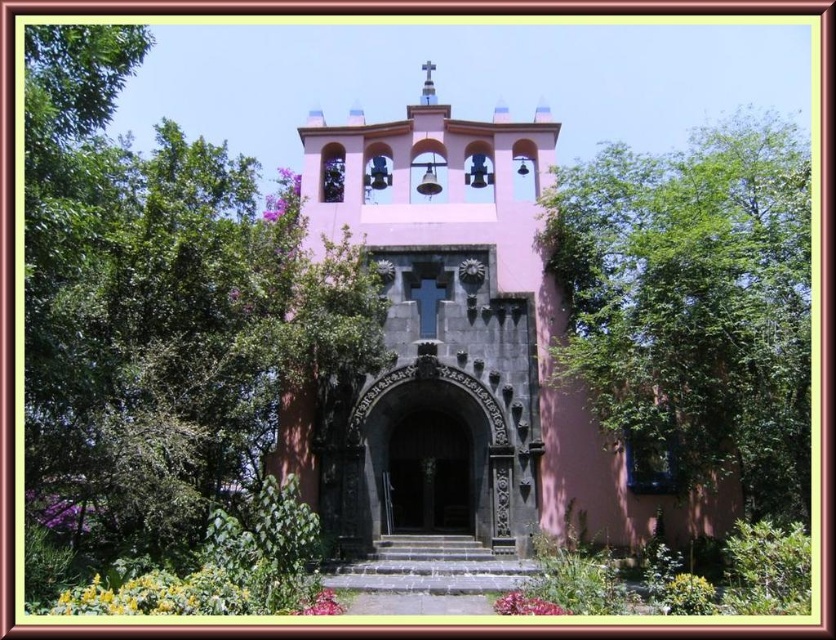
Is point (752, 161) behind point (426, 476)?

Yes, point (752, 161) is behind point (426, 476).

What do you see at coordinates (692, 307) in the screenshot? I see `green leafy tree at upper right` at bounding box center [692, 307].

Locate an element on the screen. Image resolution: width=836 pixels, height=640 pixels. green leafy tree at upper right is located at coordinates click(x=692, y=307).

Does green leafy tree at center appear on the left side of pink matte church at center?

Indeed, green leafy tree at center is positioned on the left side of pink matte church at center.

Is green leafy tree at center wider than pink matte church at center?

Indeed, green leafy tree at center has a greater width compared to pink matte church at center.

Is point (34, 435) in front of point (691, 524)?

Yes, point (34, 435) is in front of point (691, 524).

Identify the location of green leafy tree at center. The height and width of the screenshot is (640, 836). (162, 308).

Is green leafy tree at center below black polished wood door at center?

Actually, green leafy tree at center is above black polished wood door at center.

Between point (197, 177) and point (465, 426), which one is positioned in front?

Positioned in front is point (197, 177).

This screenshot has height=640, width=836. Identify the location of green leafy tree at center. (162, 308).